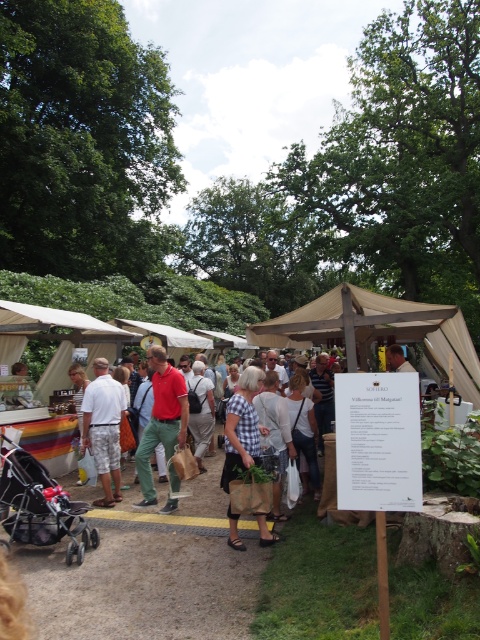
What do you see at coordinates (162, 420) in the screenshot?
I see `matte red polo shirt at center` at bounding box center [162, 420].

Is matte red polo shirt at center above white cotton shorts at center?

Indeed, matte red polo shirt at center is positioned over white cotton shorts at center.

Does point (136, 467) come closer to viewer compared to point (108, 497)?

No, it is not.

The image size is (480, 640). Identify the location of matte red polo shirt at center. (162, 420).

Who is higher up, beige canvas canopy at center or green cotton pants at center?

beige canvas canopy at center is higher up.

Where is `beige canvas canopy at center`? beige canvas canopy at center is located at coordinates (376, 330).

Measure the distance between beige canvas canopy at center and camera.

beige canvas canopy at center is 17.86 feet away from camera.

At what (x,y) coordinates should I click in order to perform the action: click on beige canvas canopy at center. Please return your answer as a coordinate pair (x, y). The width and height of the screenshot is (480, 640). Looking at the image, I should click on (376, 330).

Is green cotton pants at center below checkered fabric dress at center?

Incorrect, green cotton pants at center is not positioned below checkered fabric dress at center.

Which of these two, green cotton pants at center or checkered fabric dress at center, stands taller?

Standing taller between the two is green cotton pants at center.

The height and width of the screenshot is (640, 480). Identify the location of green cotton pants at center. (162, 419).